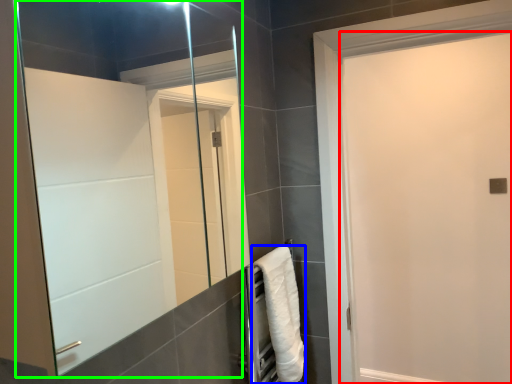
Question: Which is farther away from screen door (highlighted by a red box)? towel (highlighted by a blue box) or mirror (highlighted by a green box)?

Choices:
 (A) towel
 (B) mirror

Answer: (A)